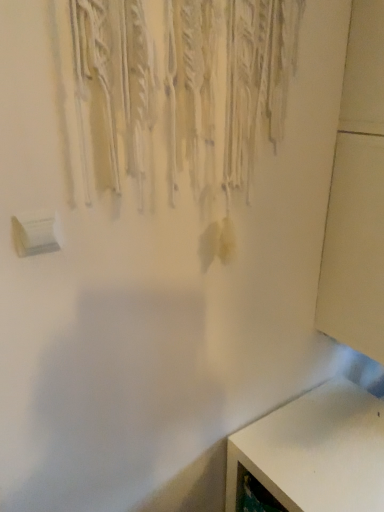
Describe the element at coordinates (316, 451) in the screenshot. I see `white glossy cabinet at lower right` at that location.

In order to click on white glossy cabinet at lower right in this screenshot , I will do point(316,451).

Locate an element on the screen. Image resolution: width=384 pixels, height=512 pixels. white glossy cabinet at lower right is located at coordinates (316, 451).